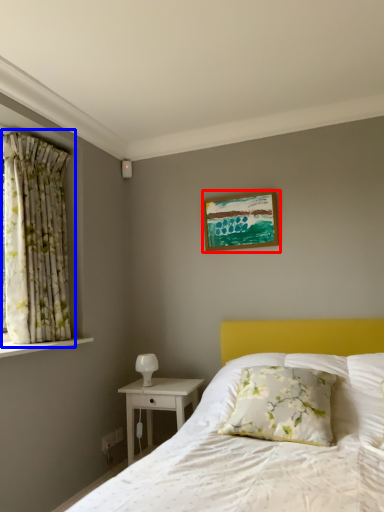
Question: Among these objects, which one is nearest to the camera, picture frame (highlighted by a red box) or curtain (highlighted by a blue box)?

Choices:
 (A) picture frame
 (B) curtain

Answer: (B)